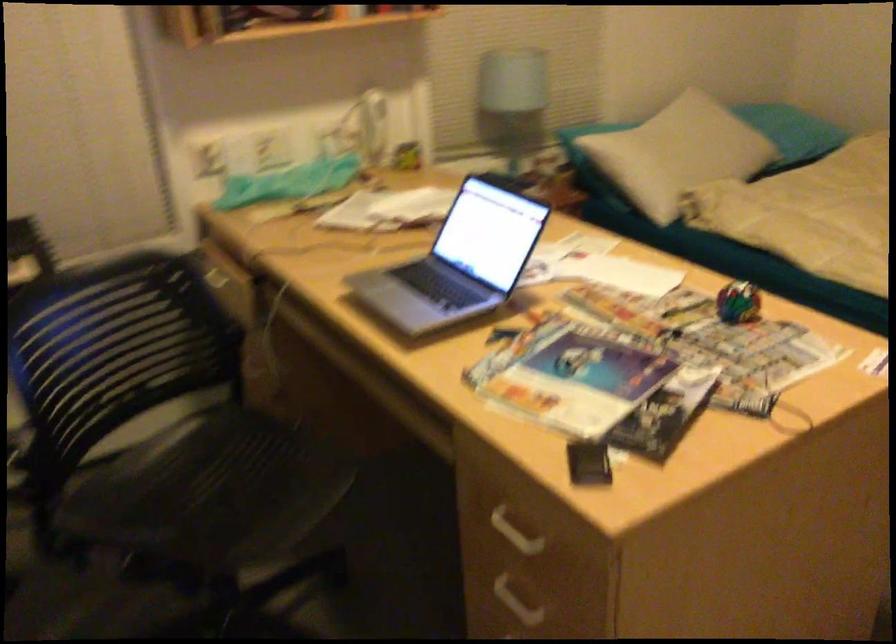
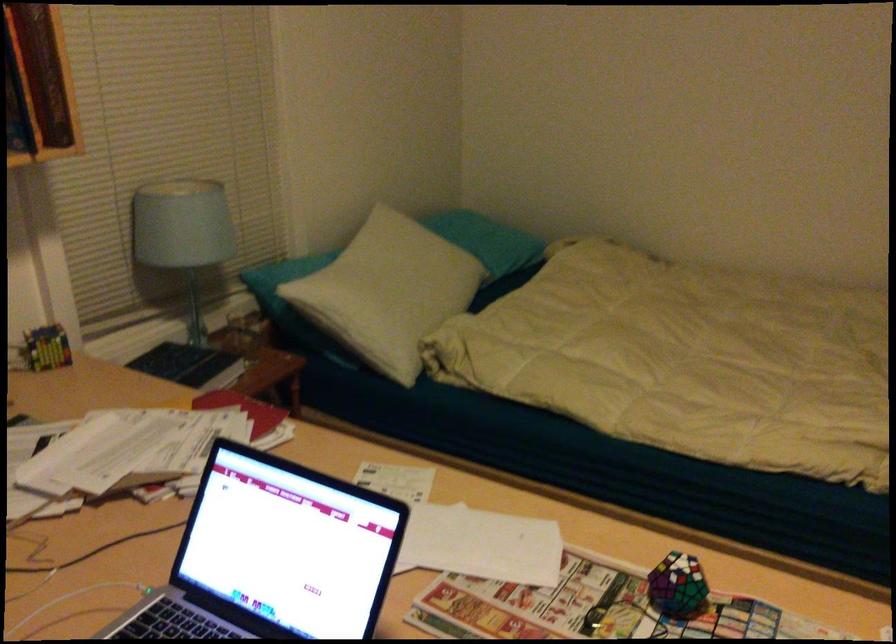
In the second image, find the point that corresponds to (503,86) in the first image.

(183, 234)